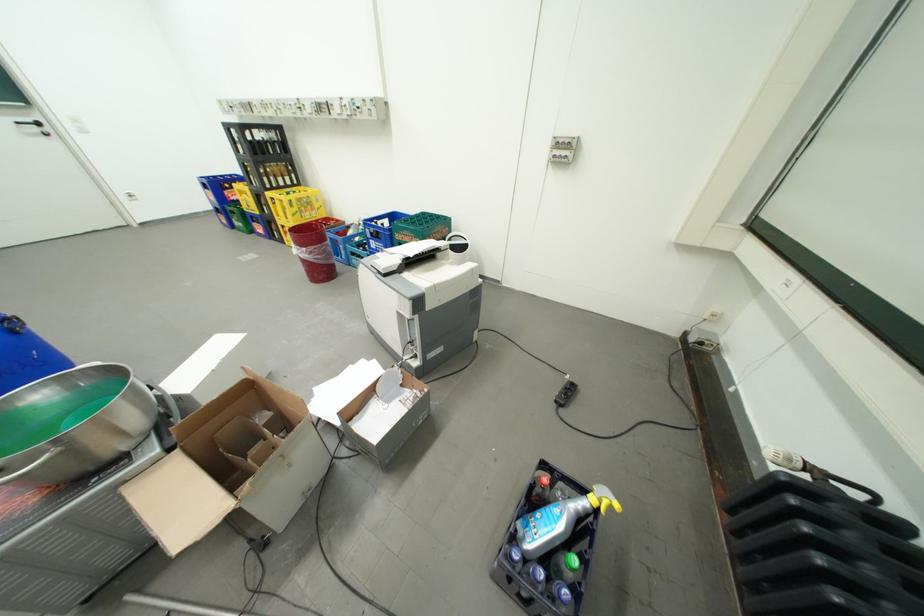
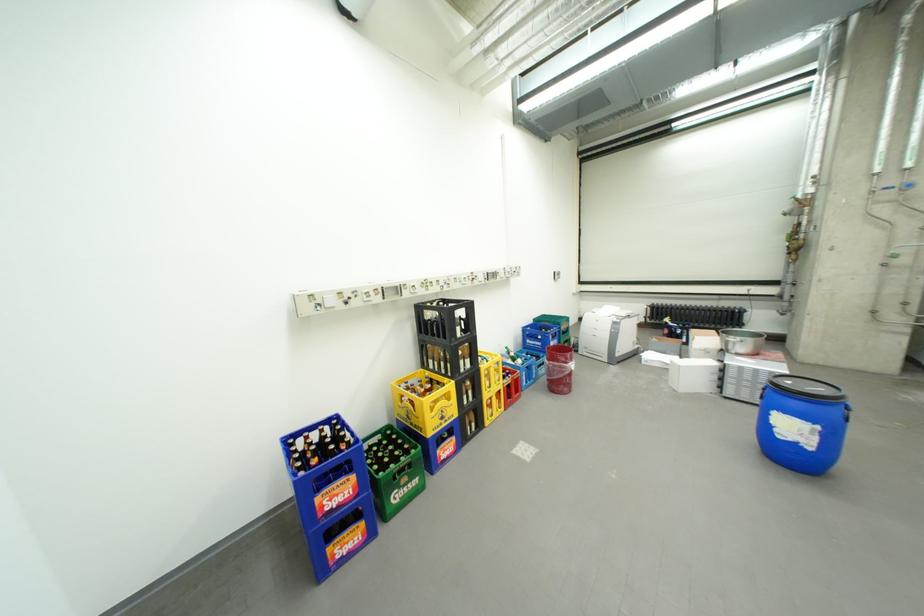
In the second image, find the point that corresponds to point (381, 241) in the first image.

(562, 344)